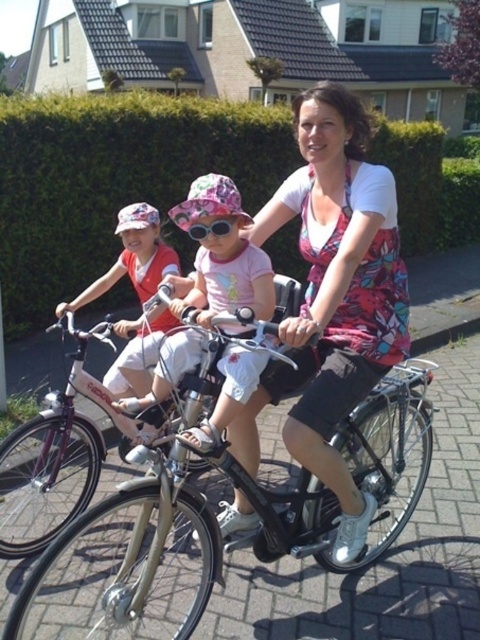
Question: Can you confirm if green leafy hedge at upper center is thinner than pink fabric goggles at center?

Choices:
 (A) yes
 (B) no

Answer: (B)

Question: Among these points, which one is nearest to the camera?

Choices:
 (A) (396, 221)
 (B) (206, 282)
 (C) (197, 241)

Answer: (C)

Question: Does floral fabric dress at center appear on the left side of pink fabric hat at center?

Choices:
 (A) no
 (B) yes

Answer: (A)

Question: Which point appears closest to the camera in this image?

Choices:
 (A) (226, 218)
 (B) (52, 582)

Answer: (A)

Question: Which object is positioned farthest from the pink fabric goggles at center?

Choices:
 (A) pink fabric hat at center
 (B) pink fabric hat at upper left
 (C) shiny gold bicycle at center

Answer: (C)

Question: Does shiny gold bicycle at center appear on the right side of green leafy hedge at upper center?

Choices:
 (A) yes
 (B) no

Answer: (B)